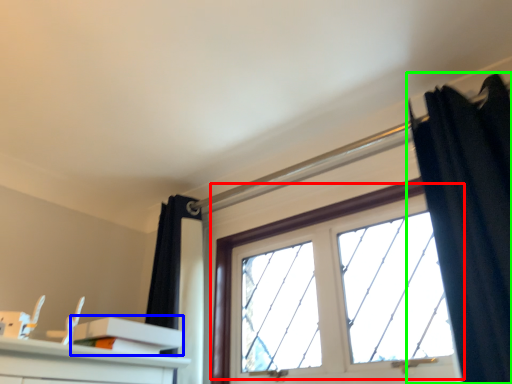
Question: Considering the real-world distances, which object is closest to window (highlighted by a red box)? shelf (highlighted by a blue box) or curtain (highlighted by a green box).

Choices:
 (A) shelf
 (B) curtain

Answer: (B)